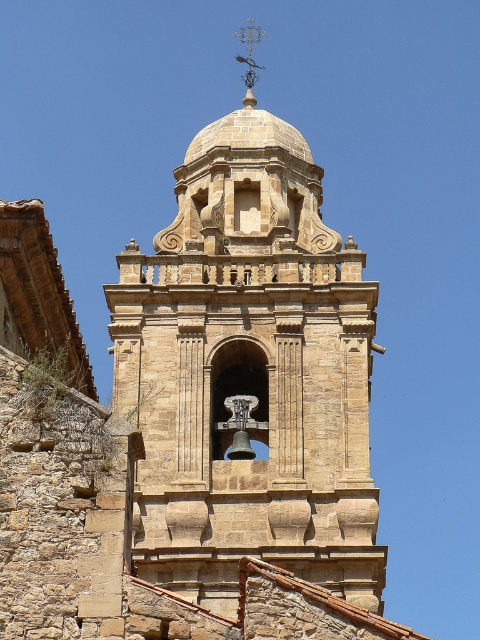
You are standing in front of the historic stone structure and want to locate the point at coordinates [249,374]. Based on the description, where would this point be located?

The point at coordinates [249,374] is located on the brown stone bell tower at center.

Based on the photo, you are an architect examining the historic stone structure. You notice the brown stone bell tower at center and the metallic weather vane at upper center. Which object occupies a larger area in the image?

The brown stone bell tower at center is bigger than the metallic weather vane at upper center, so it occupies a larger area in the image.

Based on the photo, you are a maintenance worker needing to inspect the metallic weather vane at upper center on the brown stone bell tower at center. Given that the ladder you have can extend up to 20 meters, will it be sufficient to reach the weather vane from the base of the tower?

The distance between the brown stone bell tower at center and the metallic weather vane at upper center is 21.65 meters. Since the ladder can only extend up to 20 meters, it will not be sufficient to reach the weather vane from the base of the tower.